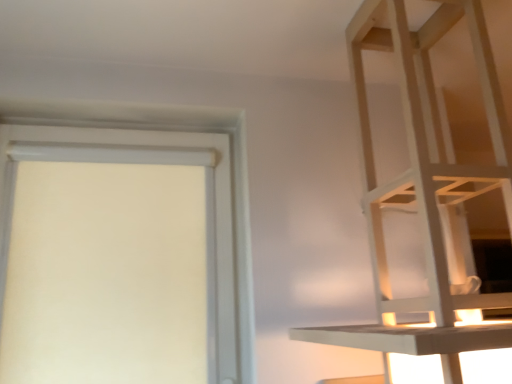
Question: Can you confirm if white matte door at left is positioned to the right of white wood shelf at upper right?

Choices:
 (A) no
 (B) yes

Answer: (A)

Question: Is white matte door at left further to the viewer compared to white wood shelf at upper right?

Choices:
 (A) yes
 (B) no

Answer: (A)

Question: Is white matte door at left positioned before white wood shelf at upper right?

Choices:
 (A) yes
 (B) no

Answer: (B)

Question: Can you confirm if white matte door at left is thinner than white wood shelf at upper right?

Choices:
 (A) yes
 (B) no

Answer: (A)

Question: Are white matte door at left and white wood shelf at upper right located far from each other?

Choices:
 (A) yes
 (B) no

Answer: (B)

Question: Considering the relative sizes of white matte door at left and white wood shelf at upper right in the image provided, is white matte door at left bigger than white wood shelf at upper right?

Choices:
 (A) no
 (B) yes

Answer: (A)

Question: Would you say white matte door at left is part of white wood shelf at upper right's contents?

Choices:
 (A) no
 (B) yes

Answer: (A)

Question: Would you say white wood shelf at upper right is a long distance from white matte door at left?

Choices:
 (A) no
 (B) yes

Answer: (A)

Question: Considering the relative sizes of white wood shelf at upper right and white matte door at left in the image provided, is white wood shelf at upper right smaller than white matte door at left?

Choices:
 (A) yes
 (B) no

Answer: (B)

Question: Is white wood shelf at upper right taller than white matte door at left?

Choices:
 (A) no
 (B) yes

Answer: (B)

Question: Is white wood shelf at upper right aimed at white matte door at left?

Choices:
 (A) yes
 (B) no

Answer: (B)

Question: From the image's perspective, is white wood shelf at upper right below white matte door at left?

Choices:
 (A) no
 (B) yes

Answer: (A)

Question: Based on their sizes in the image, would you say white matte door at left is bigger or smaller than white wood shelf at upper right?

Choices:
 (A) small
 (B) big

Answer: (A)